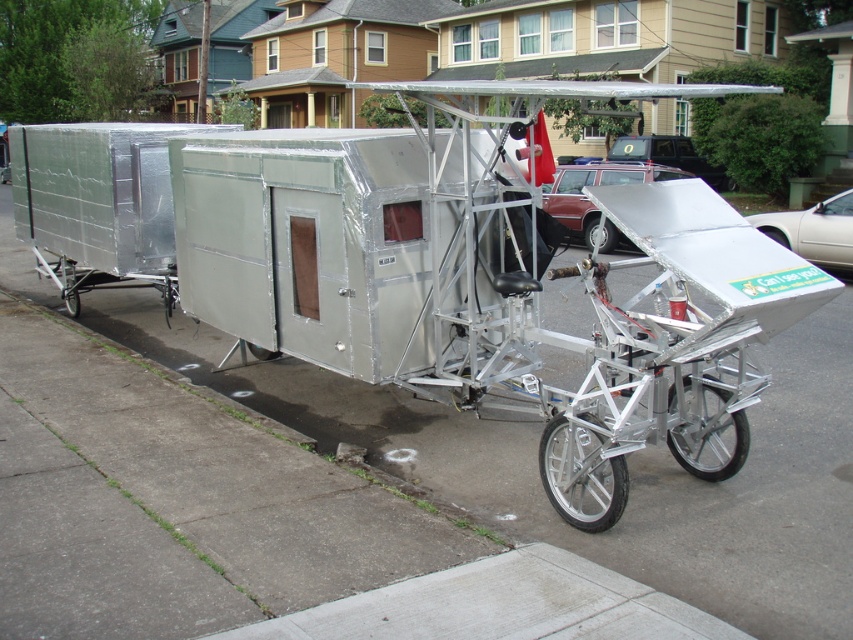
Question: Does silver metallic wheel at lower center have a smaller size compared to silver metallic wheel at center?

Choices:
 (A) yes
 (B) no

Answer: (A)

Question: Which point appears farthest from the camera in this image?

Choices:
 (A) (770, 228)
 (B) (627, 488)

Answer: (A)

Question: Does silver metallic wheel at lower left have a smaller size compared to silver metallic wheel at center?

Choices:
 (A) no
 (B) yes

Answer: (B)

Question: Does silver metallic wheel at lower left have a lesser width compared to silver metallic wheel at center?

Choices:
 (A) yes
 (B) no

Answer: (A)

Question: Estimate the real-world distances between objects in this image. Which object is farther from the silver metallic wheel at lower center?

Choices:
 (A) silver metallic wheel at lower right
 (B) silver metallic wheel at lower left
 (C) black rubber wheel at lower right

Answer: (C)

Question: Which object is positioned farthest from the silver metallic wheel at center?

Choices:
 (A) silver metallic wheel at lower right
 (B) black rubber wheel at lower right

Answer: (A)